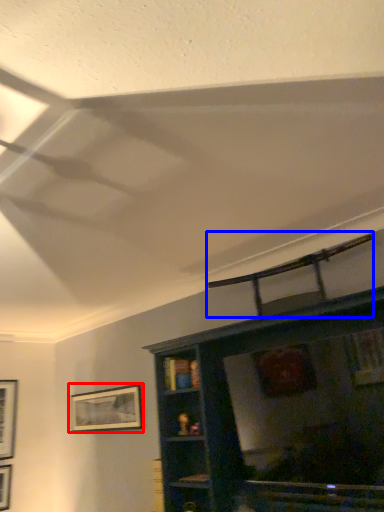
Question: Which object is closer to the camera taking this photo, picture frame (highlighted by a red box) or swivel chair (highlighted by a blue box)?

Choices:
 (A) picture frame
 (B) swivel chair

Answer: (B)